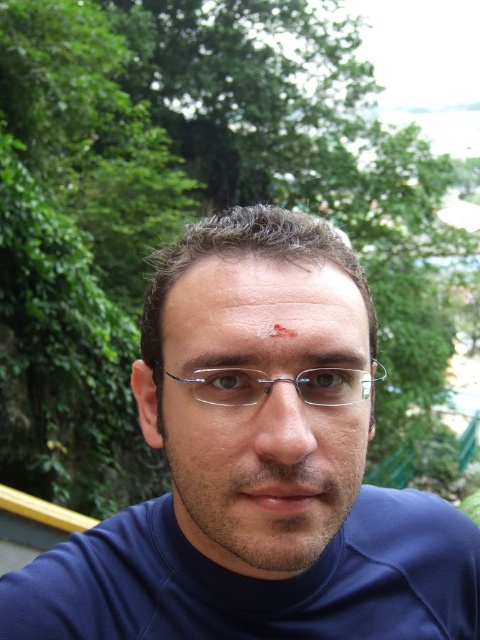
Is matte metallic glasses at center thinner than clear plastic glasses at center?

No.

Does point (260, 262) come in front of point (352, 387)?

Yes, point (260, 262) is in front of point (352, 387).

Is point (241, 348) positioned behind point (296, 378)?

No, it is not.

Find the location of a particular element. The width and height of the screenshot is (480, 640). matte metallic glasses at center is located at coordinates pos(264,410).

Can you confirm if matte metallic glasses at center is thinner than matte glass nose at center?

No.

Between matte metallic glasses at center and matte glass nose at center, which one has more height?

matte metallic glasses at center

Find the location of a particular element. matte metallic glasses at center is located at coordinates 264,410.

Image resolution: width=480 pixels, height=640 pixels. What do you see at coordinates (265, 310) in the screenshot? I see `matte skin scar at center` at bounding box center [265, 310].

Can you confirm if matte skin scar at center is shorter than clear plastic glasses at center?

Yes.

Between point (235, 259) and point (255, 381), which one is positioned in front?

Point (255, 381) is more forward.

This screenshot has width=480, height=640. Find the location of `matte skin scar at center`. matte skin scar at center is located at coordinates [x=265, y=310].